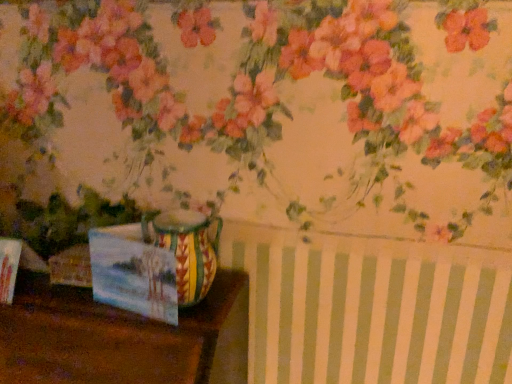
Image resolution: width=512 pixels, height=384 pixels. I want to click on multicolored ceramic vase at center, so click(x=187, y=249).

You are a GUI agent. You are given a task and a screenshot of the screen. Output one action in this format:
    pyautogui.click(x=<x>, y=<y>)
    Task: Click on the matte paper postcard at lower left
    Image resolution: width=512 pixels, height=384 pixels.
    Given the screenshot: What is the action you would take?
    pyautogui.click(x=133, y=273)

The width and height of the screenshot is (512, 384). I want to click on multicolored ceramic vase at center, so click(x=187, y=249).

Does matte paper postcard at lower left have a larger size compared to multicolored ceramic vase at center?

Actually, matte paper postcard at lower left might be smaller than multicolored ceramic vase at center.

Is matte paper postcard at lower left next to multicolored ceramic vase at center?

Yes, matte paper postcard at lower left is in contact with multicolored ceramic vase at center.

Where is `vase above the matte paper postcard at lower left (from the image's perspective)`? This screenshot has height=384, width=512. vase above the matte paper postcard at lower left (from the image's perspective) is located at coordinates (187, 249).

Is matte paper postcard at lower left positioned with its back to multicolored ceramic vase at center?

Yes, matte paper postcard at lower left's orientation is away from multicolored ceramic vase at center.

Would you say wooden table at lower left is a long distance from multicolored ceramic vase at center?

No, wooden table at lower left is not far from multicolored ceramic vase at center.

Can you confirm if wooden table at lower left is shorter than multicolored ceramic vase at center?

In fact, wooden table at lower left may be taller than multicolored ceramic vase at center.

Does wooden table at lower left turn towards multicolored ceramic vase at center?

No.

Considering the sizes of objects wooden table at lower left and matte paper postcard at lower left in the image provided, who is bigger, wooden table at lower left or matte paper postcard at lower left?

With larger size is wooden table at lower left.

Can you confirm if wooden table at lower left is shorter than matte paper postcard at lower left?

No.

Is wooden table at lower left inside or outside of matte paper postcard at lower left?

wooden table at lower left cannot be found inside matte paper postcard at lower left.

From the picture: Is wooden table at lower left to the right of matte paper postcard at lower left from the viewer's perspective?

Incorrect, wooden table at lower left is not on the right side of matte paper postcard at lower left.

Is wooden table at lower left inside matte paper postcard at lower left?

No, matte paper postcard at lower left does not contain wooden table at lower left.

Based on the photo, between matte paper postcard at lower left and wooden table at lower left, which one has more height?

wooden table at lower left is taller.

Looking at this image, from the image's perspective, which is above, matte paper postcard at lower left or wooden table at lower left?

matte paper postcard at lower left is shown above in the image.

The image size is (512, 384). I want to click on postcard behind the wooden table at lower left, so click(133, 273).

Is multicolored ceramic vase at center surrounding matte paper postcard at lower left?

Yes, matte paper postcard at lower left is surrounded by multicolored ceramic vase at center.

Is multicolored ceramic vase at center next to matte paper postcard at lower left?

Yes, multicolored ceramic vase at center is beside matte paper postcard at lower left.

Is multicolored ceramic vase at center positioned with its back to matte paper postcard at lower left?

multicolored ceramic vase at center does not have its back to matte paper postcard at lower left.

Who is smaller, multicolored ceramic vase at center or wooden table at lower left?

multicolored ceramic vase at center.

Which point is more forward, [221,222] or [11,333]?

Positioned in front is point [11,333].

Is multicolored ceramic vase at center oriented away from wooden table at lower left?

No, multicolored ceramic vase at center is not facing away from wooden table at lower left.

In the scene shown: How different are the orientations of multicolored ceramic vase at center and wooden table at lower left in degrees?

The angle between the facing direction of multicolored ceramic vase at center and the facing direction of wooden table at lower left is 1.42 degrees.

There is a matte paper postcard at lower left. Where is `vase above it (from a real-world perspective)`? This screenshot has height=384, width=512. vase above it (from a real-world perspective) is located at coordinates (187, 249).

Where is `vase on the right of wooden table at lower left`? vase on the right of wooden table at lower left is located at coordinates (187, 249).

Estimate the real-world distances between objects in this image. Which object is closer to multicolored ceramic vase at center, matte paper postcard at lower left or wooden table at lower left?

matte paper postcard at lower left.

When comparing their distances from matte paper postcard at lower left, does wooden table at lower left or multicolored ceramic vase at center seem closer?

Among the two, multicolored ceramic vase at center is located nearer to matte paper postcard at lower left.

Which object lies further to the anchor point multicolored ceramic vase at center, wooden table at lower left or matte paper postcard at lower left?

wooden table at lower left lies further to multicolored ceramic vase at center than the other object.

Based on their spatial positions, is multicolored ceramic vase at center or wooden table at lower left further from matte paper postcard at lower left?

Among the two, wooden table at lower left is located further to matte paper postcard at lower left.

Based on their spatial positions, is matte paper postcard at lower left or multicolored ceramic vase at center further from wooden table at lower left?

multicolored ceramic vase at center lies further to wooden table at lower left than the other object.

Which object lies nearer to the anchor point wooden table at lower left, multicolored ceramic vase at center or matte paper postcard at lower left?

Among the two, matte paper postcard at lower left is located nearer to wooden table at lower left.

This screenshot has width=512, height=384. In order to click on postcard between multicolored ceramic vase at center and wooden table at lower left in the vertical direction in this screenshot , I will do `click(133, 273)`.